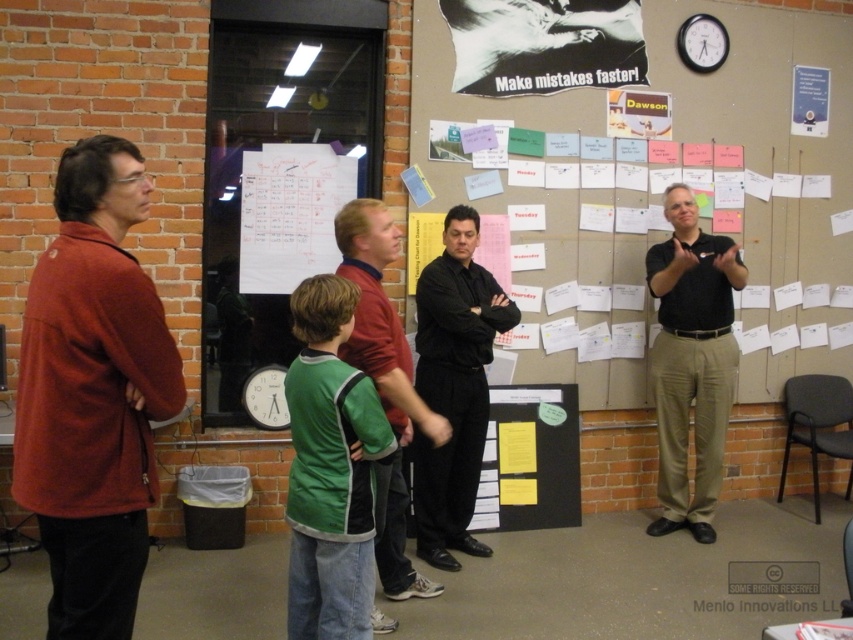
Question: Does matte red sweater at left have a greater width compared to green jersey at center?

Choices:
 (A) yes
 (B) no

Answer: (A)

Question: Which object appears closest to the camera in this image?

Choices:
 (A) white paper notes at center
 (B) matte red sweater at left

Answer: (B)

Question: Which object is the farthest from the black smooth shirt at right?

Choices:
 (A) black matte shirt at center
 (B) green jersey at center

Answer: (B)

Question: Can you confirm if black smooth shirt at right is smaller than matte blue poster at upper right?

Choices:
 (A) yes
 (B) no

Answer: (B)

Question: Is black smooth shirt at right positioned in front of green fabric shirt at center?

Choices:
 (A) yes
 (B) no

Answer: (B)

Question: Among these points, which one is nearest to the camera?

Choices:
 (A) (393, 552)
 (B) (648, 257)
 (C) (90, 392)
 (D) (790, 124)

Answer: (C)